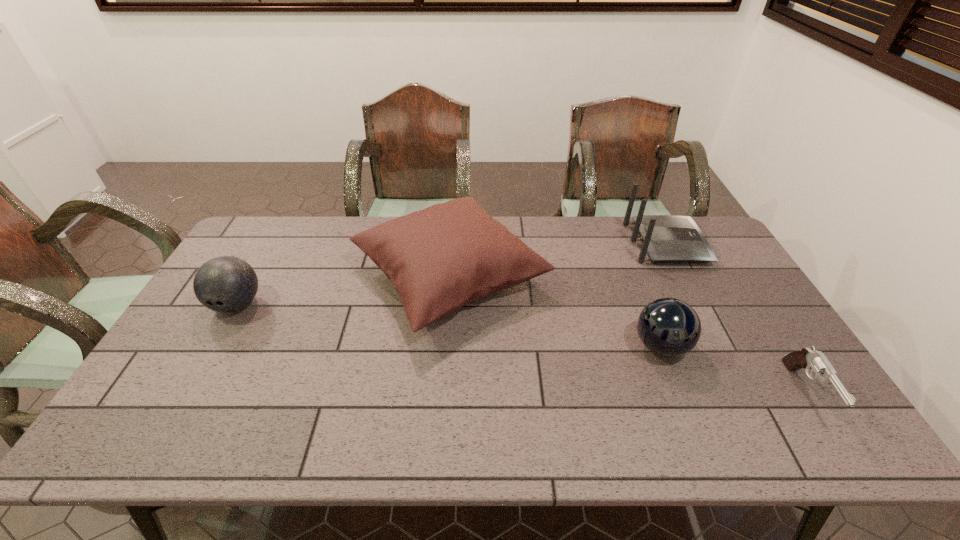
I want to click on vacant region at the far edge of the desktop, so click(x=292, y=253).

This screenshot has height=540, width=960. In the image, there is a desktop. In order to click on vacant space at the near edge in this screenshot , I will do `click(216, 448)`.

Locate an element on the screen. blank area at the right edge is located at coordinates (741, 364).

At what (x,y) coordinates should I click in order to perform the action: click on vacant area at the far left corner. Please return your answer as a coordinate pair (x, y). The image size is (960, 540). Looking at the image, I should click on (261, 239).

Where is `blank region between the right bowling ball and the fourth object from right to left`? Image resolution: width=960 pixels, height=540 pixels. blank region between the right bowling ball and the fourth object from right to left is located at coordinates (555, 312).

The height and width of the screenshot is (540, 960). Identify the location of vacant space in between the router and the rightmost object. (735, 319).

The image size is (960, 540). Identify the location of vacant area that lies between the left bowling ball and the cushion. (344, 291).

Image resolution: width=960 pixels, height=540 pixels. I want to click on vacant point located between the second object from left to right and the farther bowling ball, so click(344, 291).

Where is `unoccupied position between the cushion and the nearer bowling ball`? The image size is (960, 540). unoccupied position between the cushion and the nearer bowling ball is located at coordinates (555, 312).

Locate an element on the screen. This screenshot has width=960, height=540. empty location between the farther bowling ball and the right bowling ball is located at coordinates (448, 325).